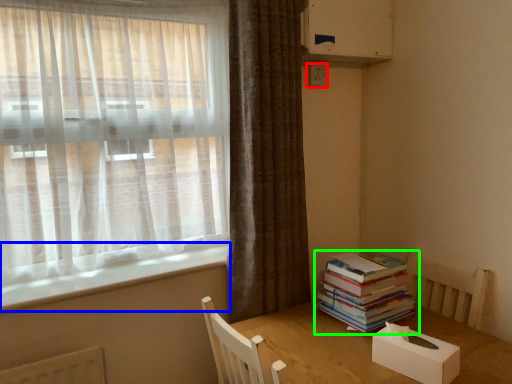
Question: Which is nearer to the electric outlet (highlighted by a red box)? window sill (highlighted by a blue box) or book (highlighted by a green box).

Choices:
 (A) window sill
 (B) book

Answer: (B)